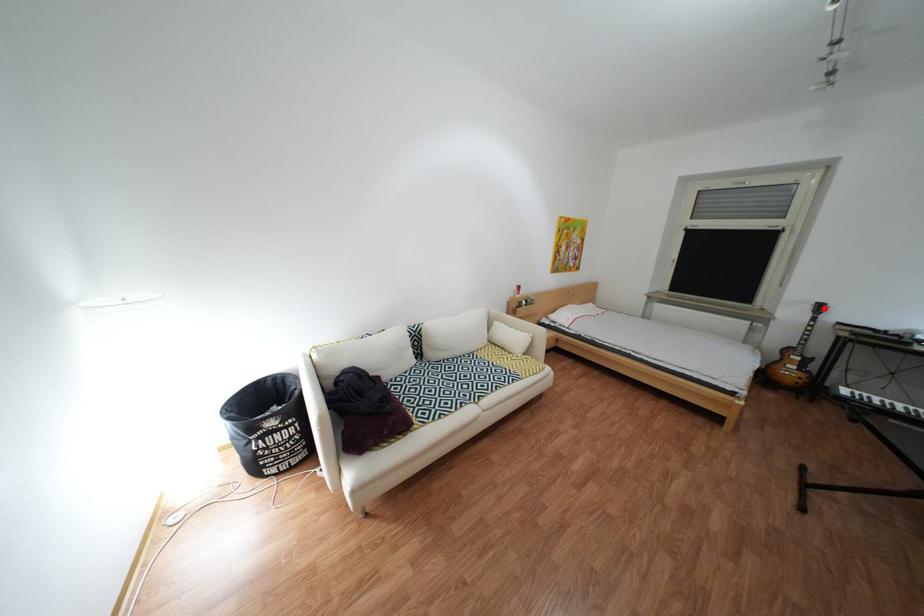
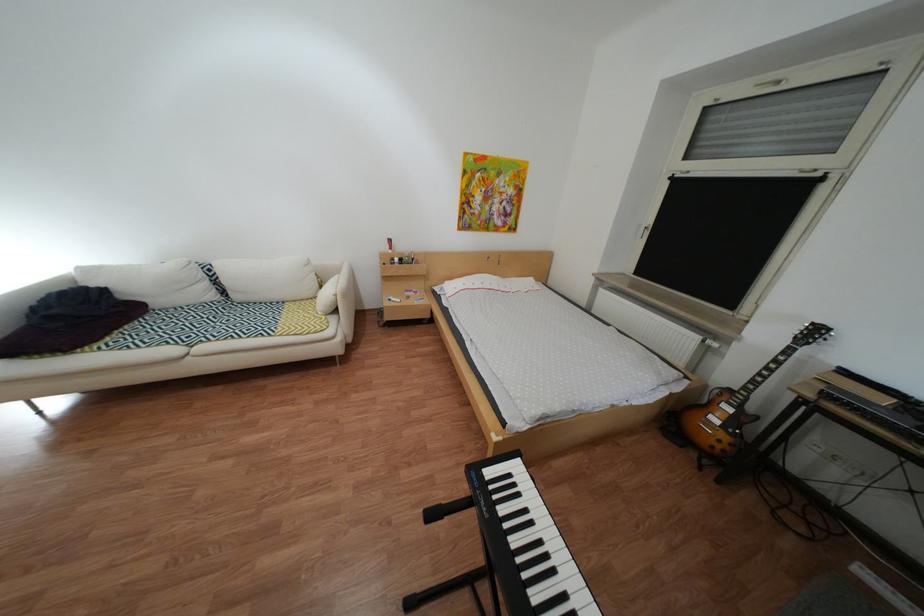
Question: I am providing you with two images of the same scene from different viewpoints. A red point is shown in image1. For the corresponding object point in image2, is it positioned nearer or farther from the camera?

Choices:
 (A) Nearer
 (B) Farther

Answer: (B)